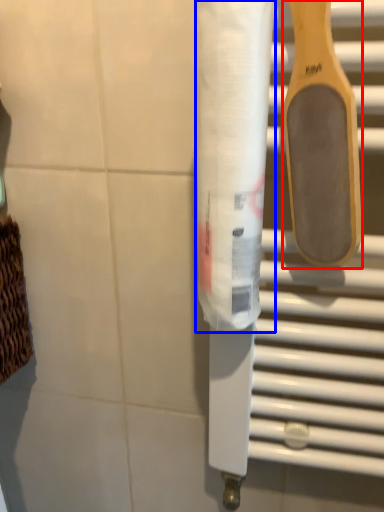
Question: Which object appears closest to the camera in this image, spatula (highlighted by a red box) or toilet paper (highlighted by a blue box)?

Choices:
 (A) spatula
 (B) toilet paper

Answer: (A)